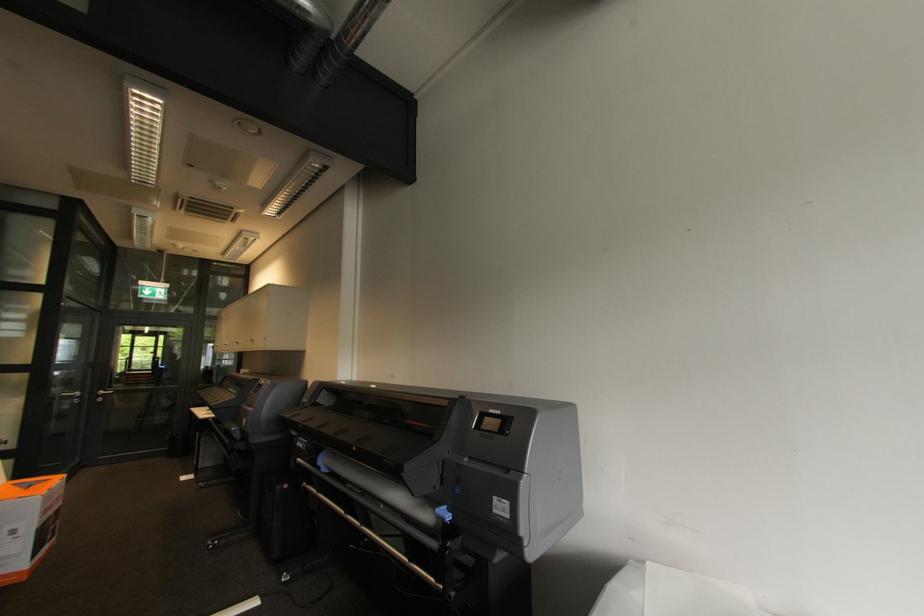
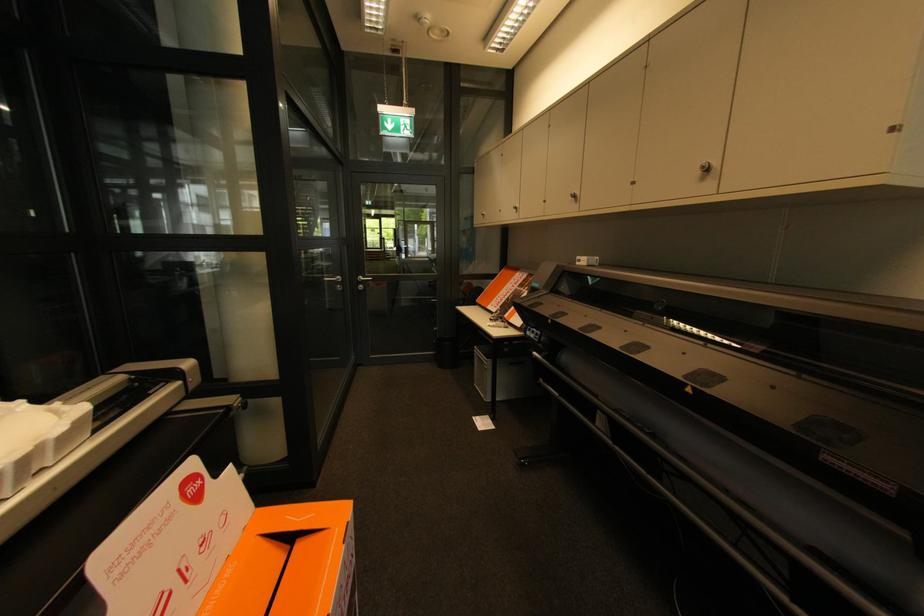
The point at (103, 400) is marked in the first image. Where is the corresponding point in the second image?

(365, 286)